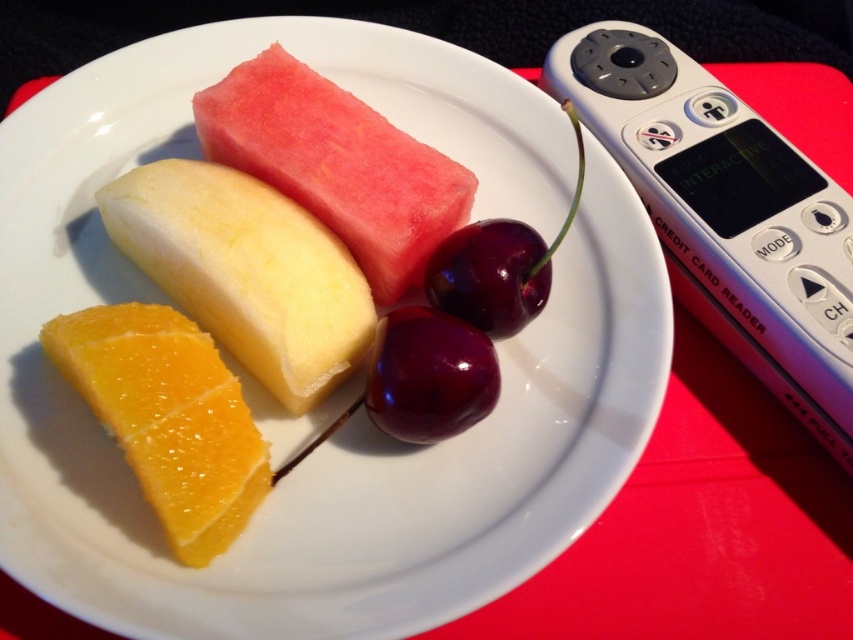
You are a delivery robot that needs to pick up the yellow matte apple at center from the table. The robot has a 50 cm reach. Can you reach it from your current position next to the white plastic remote at right?

The white plastic remote at right and yellow matte apple at center are 58.12 centimeters apart. Since the robot has a 50 cm reach, it cannot reach the yellow matte apple at center from its current position next to the white plastic remote at right.

You are setting up a fruit display and need to arrange items on a shelf. The shelf has a width limit of 15 cm. You have the white plastic remote at right and the yellow matte apple at center. Which item can you place on the shelf without exceeding the width limit?

The yellow matte apple at center can be placed on the shelf without exceeding the width limit because the white plastic remote at right is wider than the yellow matte apple at center.

Looking at this image, you are at a buffet and want to grab the red matte watermelon at center. However, there is a white plastic remote at right in the way. Can you reach the watermelon without moving the remote?

The white plastic remote at right is to the right of the red matte watermelon at center, so you can reach the red matte watermelon at center without moving the remote since it is positioned to the right of it.